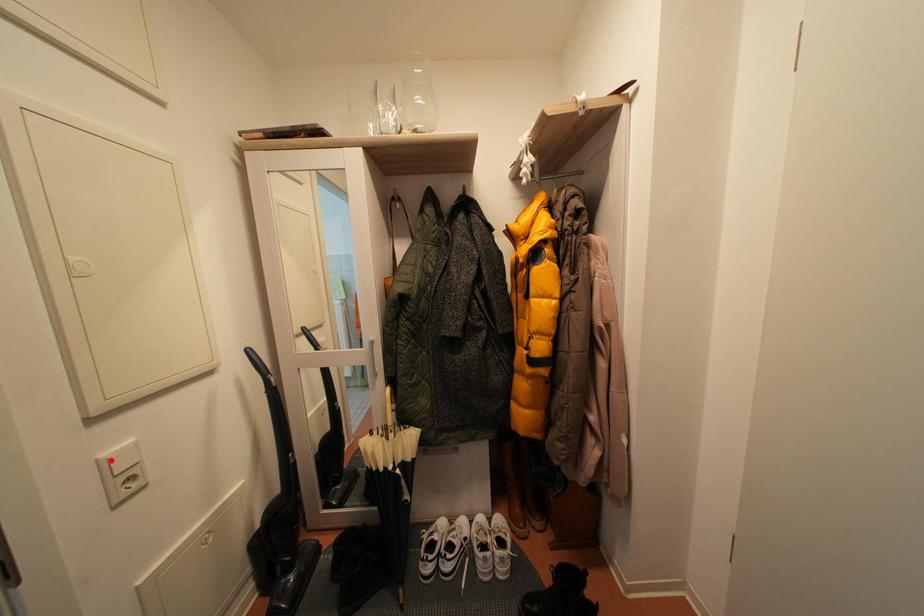
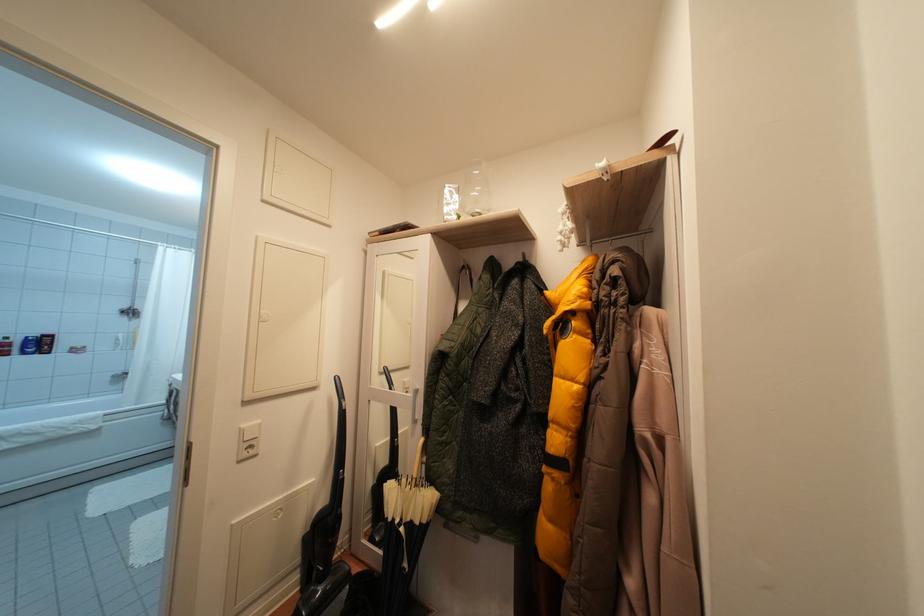
The point at the highlighted location is marked in the first image. Where is the corresponding point in the second image?

(250, 431)